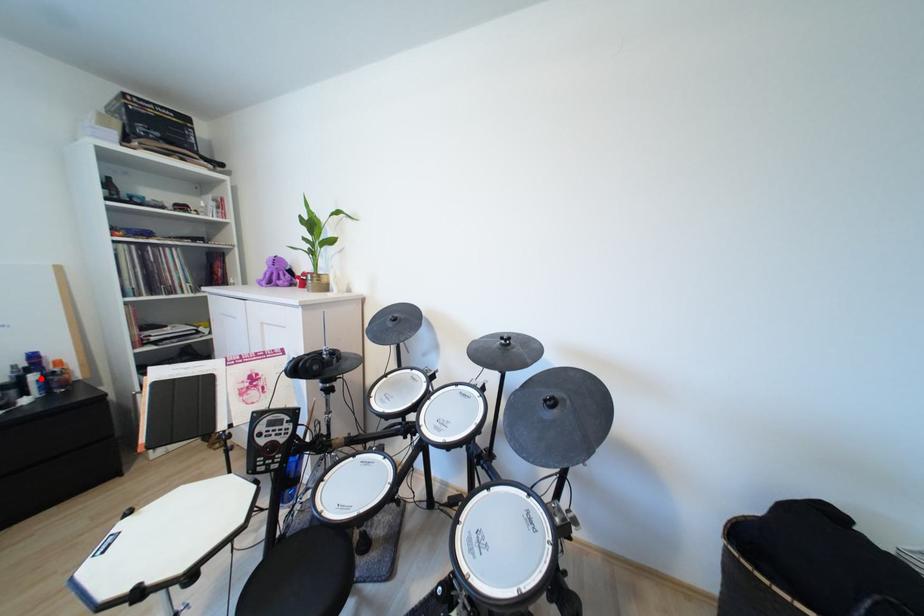
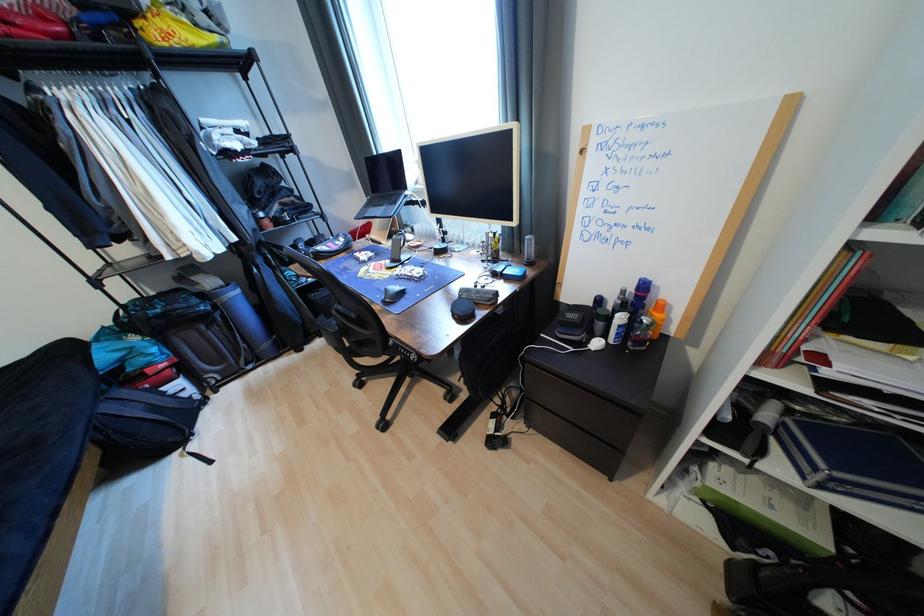
Where in the second image is the point corresponding to the highlighted location from the first image?

(627, 320)